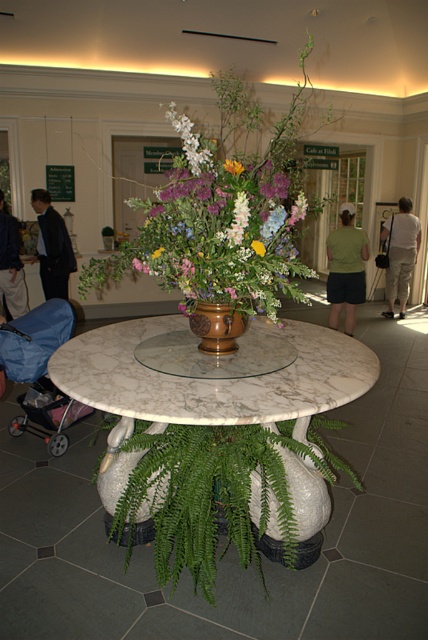
Who is more distant from viewer, (264, 186) or (240, 172)?

The point (240, 172) is more distant.

Between purple matte flower at center and pastel floral bouquet at center, which one is positioned higher?

pastel floral bouquet at center is above.

Is point (285, 186) positioned before point (226, 161)?

That is True.

At what (x,y) coordinates should I click in order to perform the action: click on purple matte flower at center. Please return your answer as a coordinate pair (x, y). Looking at the image, I should click on (276, 186).

Who is higher up, brown glossy vase at center or purple matte flower at center?

Positioned higher is purple matte flower at center.

Which of these two, brown glossy vase at center or purple matte flower at center, stands taller?

Standing taller between the two is purple matte flower at center.

Identify the location of brown glossy vase at center. This screenshot has width=428, height=640. (216, 326).

Image resolution: width=428 pixels, height=640 pixels. In order to click on brown glossy vase at center in this screenshot , I will do `click(216, 326)`.

Is light beige pants at center smaller than pastel floral bouquet at center?

Incorrect, light beige pants at center is not smaller in size than pastel floral bouquet at center.

Who is more distant from viewer, (392, 225) or (231, 164)?

Point (392, 225)

Between point (386, 221) and point (226, 160), which one is positioned in front?

Point (226, 160) is more forward.

Where is `light beige pants at center`? This screenshot has height=640, width=428. light beige pants at center is located at coordinates [x=400, y=253].